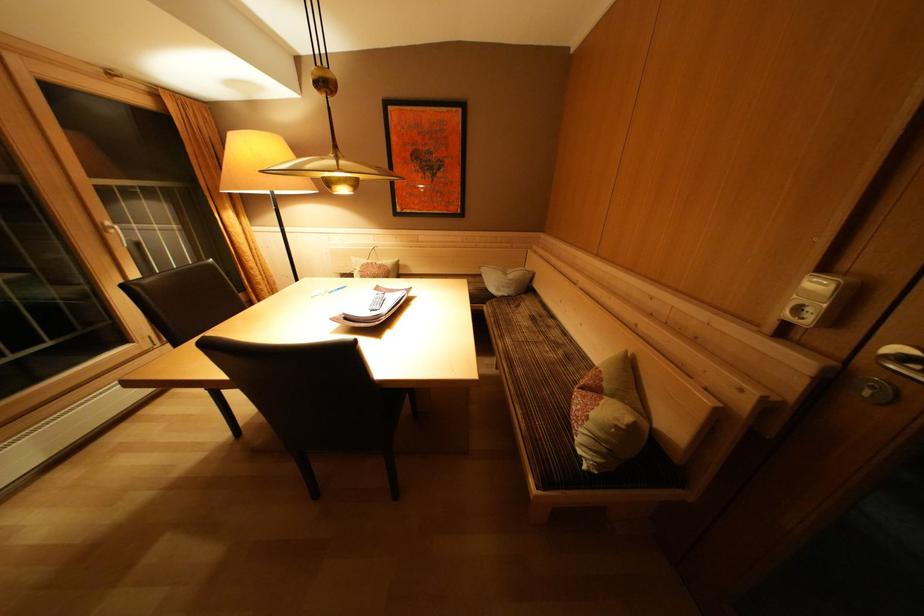
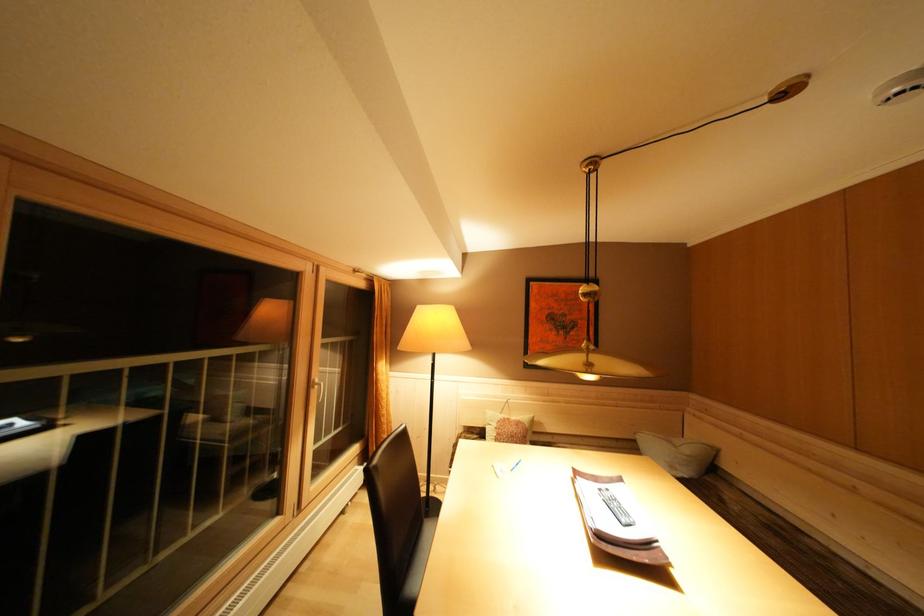
The point at (517, 281) is marked in the first image. Where is the corresponding point in the second image?

(695, 456)